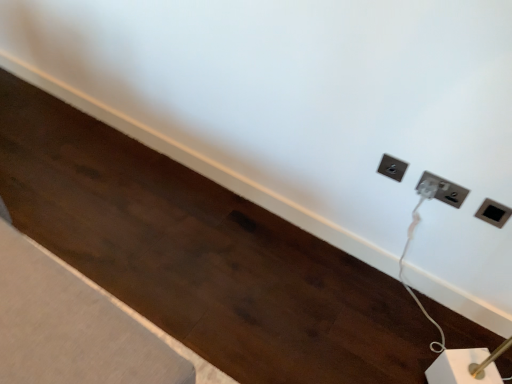
Question: Considering the positions of black plastic power plugs and sockets at upper right, arranged as the 1th power plugs and sockets when viewed from the left, and white plastic power plug at upper right, placed as the second power plugs and sockets when sorted from right to left, in the image, is black plastic power plugs and sockets at upper right, arranged as the 1th power plugs and sockets when viewed from the left, taller or shorter than white plastic power plug at upper right, placed as the second power plugs and sockets when sorted from right to left,?

Choices:
 (A) tall
 (B) short

Answer: (A)

Question: Considering the positions of black plastic power plugs and sockets at upper right, arranged as the 1th power plugs and sockets when viewed from the left, and white plastic power plug at upper right, which is the second power plugs and sockets in left-to-right order, in the image, is black plastic power plugs and sockets at upper right, arranged as the 1th power plugs and sockets when viewed from the left, bigger or smaller than white plastic power plug at upper right, which is the second power plugs and sockets in left-to-right order,?

Choices:
 (A) small
 (B) big

Answer: (B)

Question: Estimate the real-world distances between objects in this image. Which object is closer to the black plastic power plugs and sockets at upper right, marked as the 3th power plugs and sockets in a right-to-left arrangement?

Choices:
 (A) black plastic socket at upper right, the 1th power plugs and sockets from the right
 (B) white plastic power plug at upper right, which is the second power plugs and sockets in left-to-right order

Answer: (B)

Question: Which of these objects is positioned farthest from the black plastic power plugs and sockets at upper right, arranged as the 1th power plugs and sockets when viewed from the left?

Choices:
 (A) white plastic power plug at upper right, which is the second power plugs and sockets in left-to-right order
 (B) black plastic socket at upper right, the 1th power plugs and sockets from the right

Answer: (B)